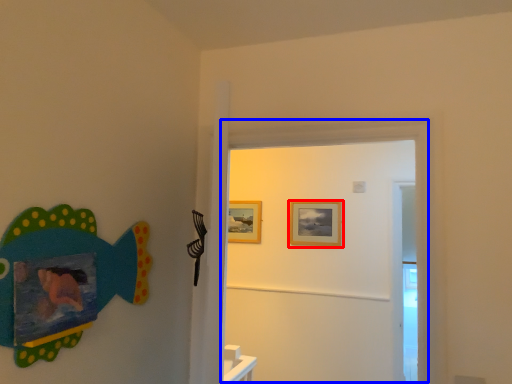
Question: Among these objects, which one is farthest to the camera, picture frame (highlighted by a red box) or door (highlighted by a blue box)?

Choices:
 (A) picture frame
 (B) door

Answer: (A)